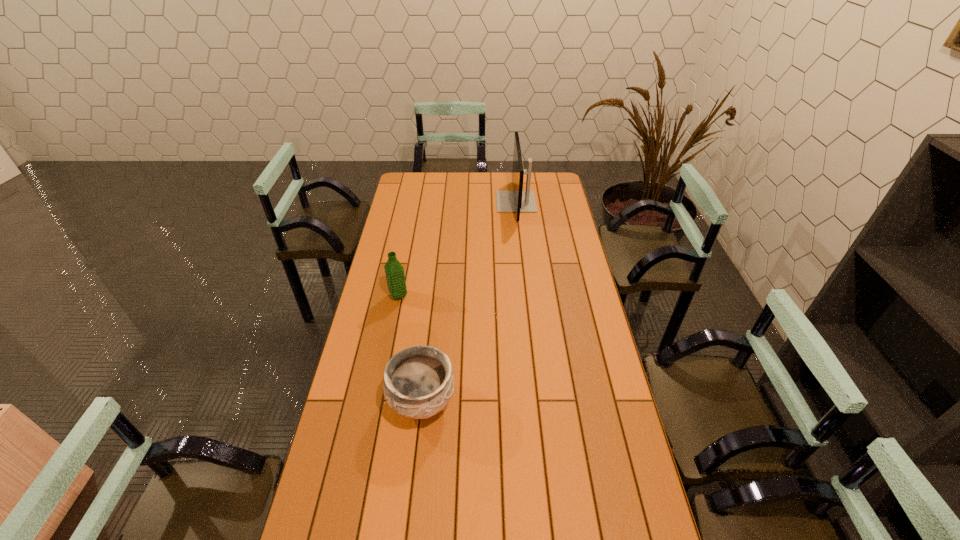
I want to click on computer monitor, so click(x=517, y=200).

This screenshot has height=540, width=960. I want to click on the rightmost object, so click(517, 200).

Where is `the second farthest object`? The image size is (960, 540). the second farthest object is located at coordinates (394, 271).

At what (x,y) coordinates should I click in order to perform the action: click on water bottle. Please return your answer as a coordinate pair (x, y). Looking at the image, I should click on (394, 271).

Find the location of `the shortest object`. the shortest object is located at coordinates (418, 383).

Locate an element on the screen. the nearest object is located at coordinates (418, 383).

This screenshot has width=960, height=540. I want to click on blank space located on the screen of the tallest object, so click(x=437, y=202).

Identify the location of vacant region located 0.210m on the screen of the tallest object. The width and height of the screenshot is (960, 540). (456, 202).

I want to click on vacant space located on the screen of the tallest object, so click(x=439, y=202).

Locate an element on the screen. The image size is (960, 540). vacant space situated on the right of the water bottle is located at coordinates (498, 295).